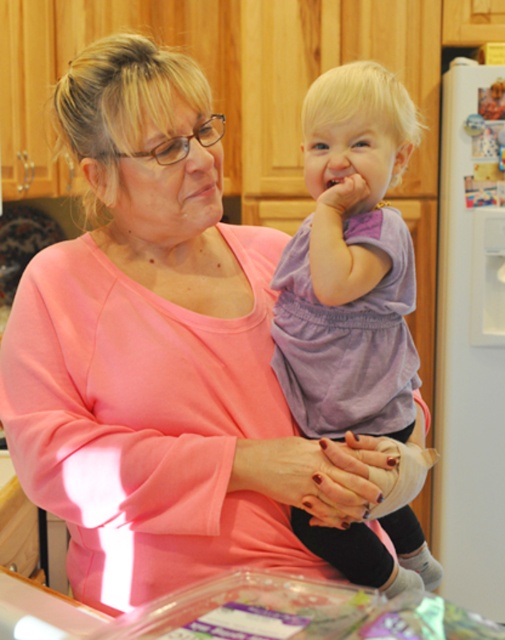
Question: Does purple soft fabric dress at center appear on the left side of nail polish painted fingernails at center?

Choices:
 (A) yes
 (B) no

Answer: (B)

Question: Which point is closer to the camera?

Choices:
 (A) (299, 323)
 (B) (345, 513)

Answer: (B)

Question: Can you confirm if purple soft fabric dress at center is wider than nail polish painted fingernails at center?

Choices:
 (A) yes
 (B) no

Answer: (A)

Question: Is purple soft fabric dress at center behind nail polish painted fingernails at center?

Choices:
 (A) yes
 (B) no

Answer: (A)